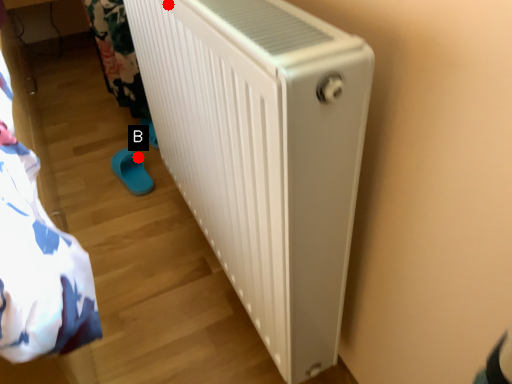
Question: Two points are circled on the image, labeled by A and B beside each circle. Which point appears farthest from the camera in this image?

Choices:
 (A) A is further
 (B) B is further

Answer: (B)